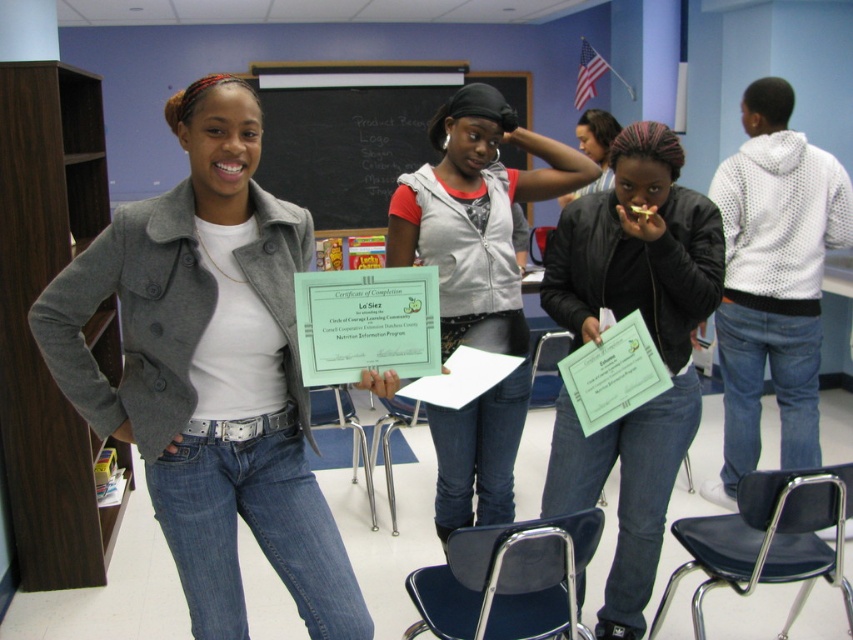
You are a student in the classroom and want to hang a poster on the wall between the matte gray jacket at center and the blackboard at upper center. Is there enough space between them for the poster?

The matte gray jacket at center is below the blackboard at upper center, so there is space between them for the poster.

You are a tailor trying to decide which jacket to alter for a client who prefers a more fitted style. Based on the image, which jacket between the matte gray jacket at center and the black leather jacket at center is more likely to require less tailoring to achieve a slimmer fit?

The black leather jacket at center is more likely to require less tailoring to achieve a slimmer fit because it is narrower than the matte gray jacket at center.

You are standing in the classroom and want to pick up the certificate held by the woman on the left. The certificate is marked with the coordinates point (163,209). If you can reach up to 1.6 meters, can you comfortably reach it?

The point (163,209) and viewer are 1.59 meters apart from each other. Since your reach is up to 1.6 meters, you can comfortably reach the certificate.